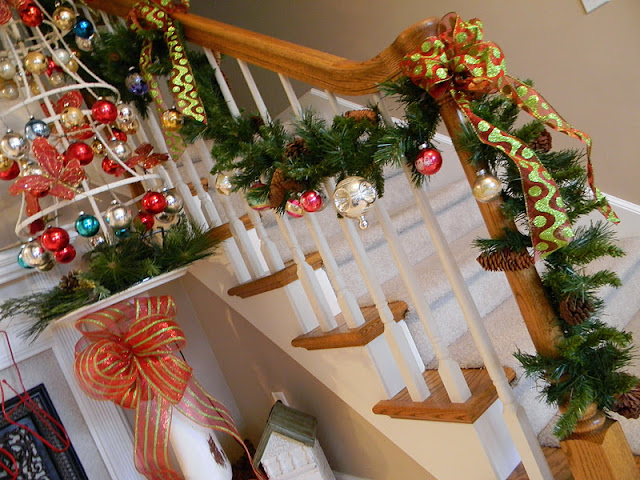
Find the location of `rug`. rug is located at coordinates (468, 253).